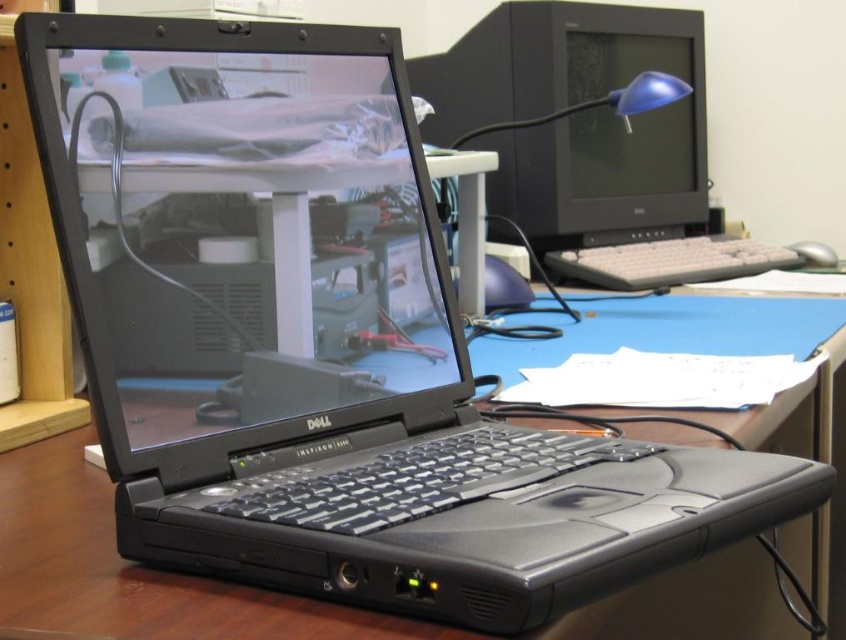
Is white plastic keyboard at center to the left of silver metallic mouse at right from the viewer's perspective?

Correct, you'll find white plastic keyboard at center to the left of silver metallic mouse at right.

Which is below, white plastic keyboard at center or silver metallic mouse at right?

white plastic keyboard at center is below.

Find the location of a particular element. This screenshot has height=640, width=846. white plastic keyboard at center is located at coordinates (669, 260).

Based on the photo, is matte black monitor at upper right thinner than silver metallic mouse at right?

In fact, matte black monitor at upper right might be wider than silver metallic mouse at right.

Between matte black monitor at upper right and silver metallic mouse at right, which one has more height?

matte black monitor at upper right

Which is in front, point (669, 216) or point (806, 259)?

Point (806, 259) is more forward.

The width and height of the screenshot is (846, 640). I want to click on matte black monitor at upper right, so click(x=575, y=118).

Which is behind, point (53, 204) or point (512, 189)?

The point (512, 189) is more distant.

Who is more forward, (91,246) or (586,83)?

Point (91,246) is in front.

Identify the location of matte black laptop at center. Image resolution: width=846 pixels, height=640 pixels. tap(239, 227).